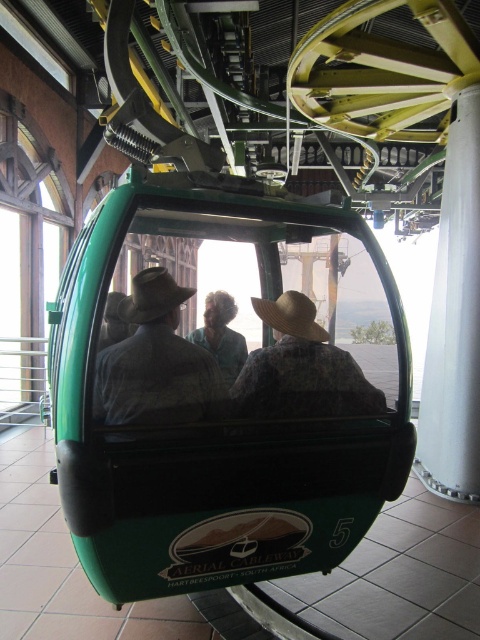
Question: Among these objects, which one is farthest from the camera?

Choices:
 (A) brown straw hat at center
 (B) beige straw cowboy hat at left
 (C) matte straw hat at center

Answer: (A)

Question: Estimate the real-world distances between objects in this image. Which object is farther from the green fabric hat at center?

Choices:
 (A) green matte/glossy cable car at center
 (B) brown felt hat at center
 (C) beige straw cowboy hat at left

Answer: (A)

Question: Is green matte/glossy cable car at center to the left of brown straw hat at center from the viewer's perspective?

Choices:
 (A) no
 (B) yes

Answer: (A)

Question: In this image, where is green matte/glossy cable car at center located relative to brown straw hat at center?

Choices:
 (A) left
 (B) right

Answer: (B)

Question: Considering the real-world distances, which object is closest to the green fabric hat at center?

Choices:
 (A) green matte/glossy cable car at center
 (B) beige straw cowboy hat at left
 (C) brown felt hat at center

Answer: (C)

Question: Is green matte/glossy cable car at center bigger than brown straw hat at center?

Choices:
 (A) yes
 (B) no

Answer: (A)